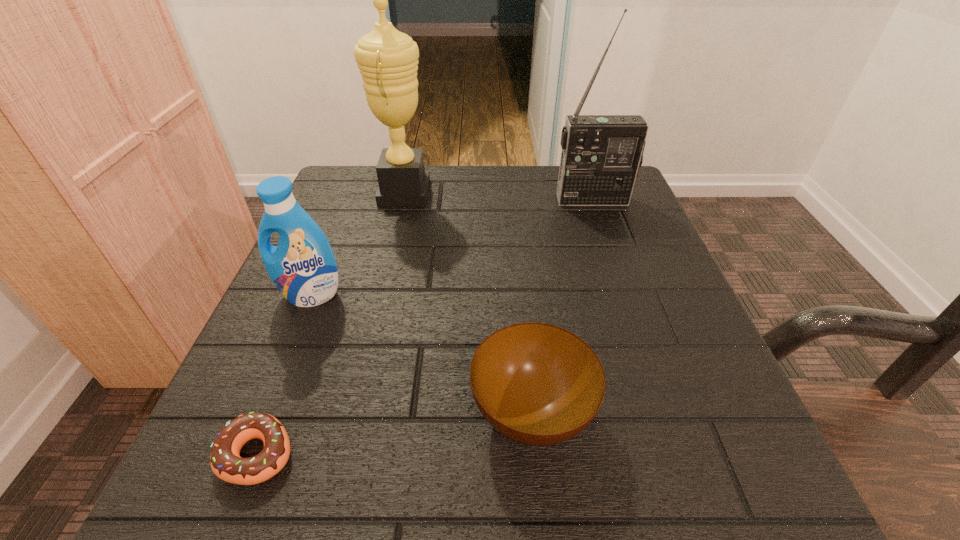
Find the location of a particular element. This screenshot has height=540, width=960. free space between the trophy cup and the doughnut is located at coordinates (331, 323).

Where is `free area in between the trophy cup and the rightmost object`? free area in between the trophy cup and the rightmost object is located at coordinates (498, 196).

The width and height of the screenshot is (960, 540). In order to click on free space between the bowl and the doughnut in this screenshot , I will do `click(395, 434)`.

In order to click on free spot between the doughnut and the radio receiver in this screenshot , I will do `click(425, 326)`.

Where is `empty space that is in between the trophy cup and the doughnut`? This screenshot has width=960, height=540. empty space that is in between the trophy cup and the doughnut is located at coordinates (331, 323).

Find the location of `free space between the fourth tallest object and the trophy cup`. free space between the fourth tallest object and the trophy cup is located at coordinates (468, 303).

In order to click on free spot between the radio receiver and the doughnut in this screenshot , I will do `click(425, 326)`.

Find the location of a particular element. vacant space that's between the doughnut and the rightmost object is located at coordinates (425, 326).

Find the location of a particular element. free spot between the trophy cup and the rightmost object is located at coordinates (498, 196).

Find the location of `free area in between the trophy cup and the detergent`. free area in between the trophy cup and the detergent is located at coordinates (358, 244).